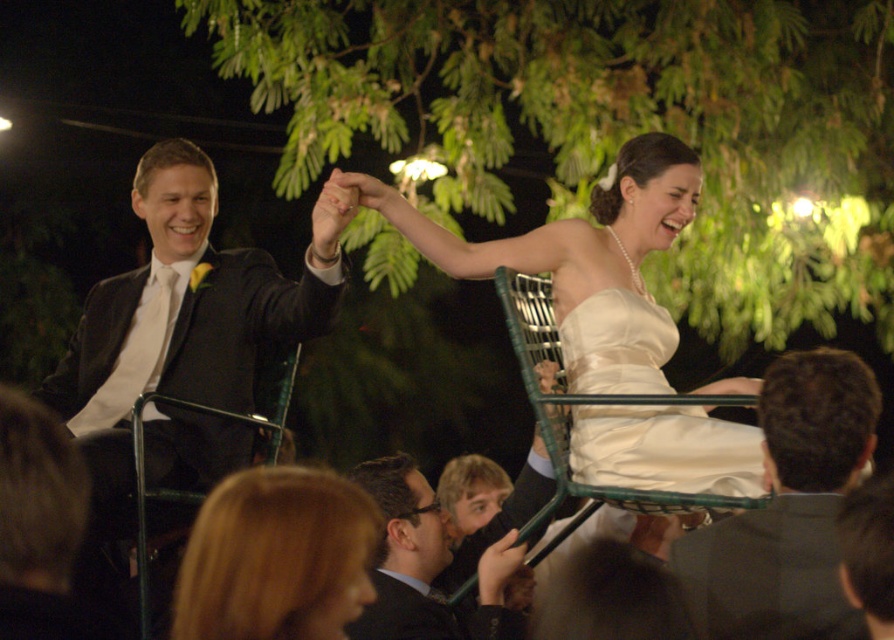
You are a photographer at a wedding reception. You want to take a photo of the satin white dress at center and the dark brown suit at lower center. Based on their positions, which one should you focus on first to ensure both are in the frame?

The satin white dress at center is in front of the dark brown suit at lower center, so you should focus on the dark brown suit at lower center first to ensure both are in the frame.

You are a photographer at the wedding reception. You need to capture a photo that includes both the ivory satin dress at center and the dark brown suit at lower center. Considering their sizes, which one should you focus on to ensure both fit well in the frame?

The ivory satin dress at center is wider than the dark brown suit at lower center, so focusing on the ivory satin dress at center will ensure both fit well in the frame.